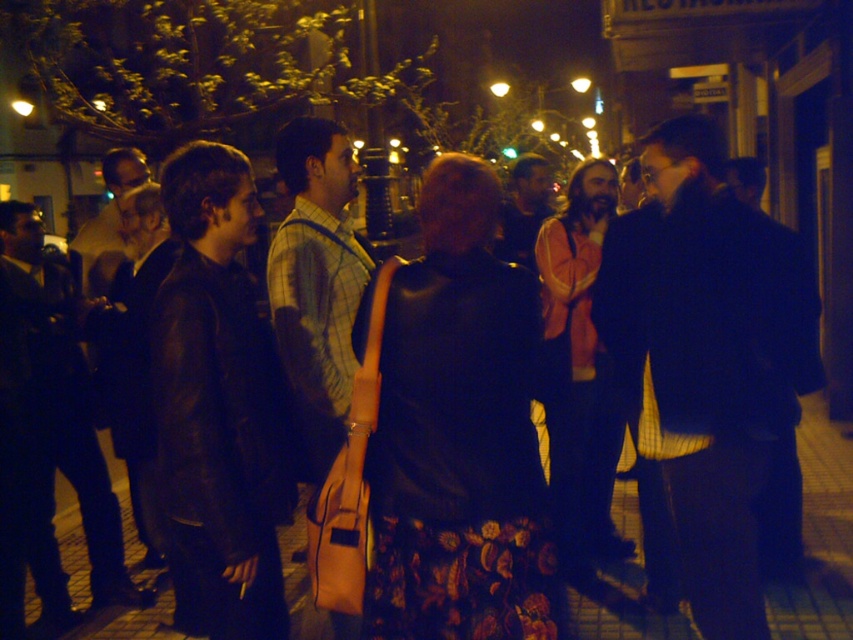
The image size is (853, 640). What do you see at coordinates (709, 355) in the screenshot?
I see `dark blue jacket at center` at bounding box center [709, 355].

Who is more distant from viewer, (700, 464) or (55, 275)?

The point (55, 275) is more distant.

Find the location of a particular element. The width and height of the screenshot is (853, 640). dark blue jacket at center is located at coordinates (709, 355).

Does leather jacket at left have a greater width compared to plaid fabric shirt at center?

Correct, the width of leather jacket at left exceeds that of plaid fabric shirt at center.

Which of these two, leather jacket at left or plaid fabric shirt at center, stands shorter?

plaid fabric shirt at center is shorter.

Which is behind, point (173, 385) or point (352, 173)?

The point (352, 173) is more distant.

I want to click on leather jacket at left, so click(x=219, y=401).

Is point (306, 150) closer to viewer compared to point (28, 538)?

That is True.

Who is lower down, plaid fabric shirt at center or dark brown leather jacket at left?

dark brown leather jacket at left is below.

This screenshot has height=640, width=853. In order to click on plaid fabric shirt at center in this screenshot , I will do (317, 282).